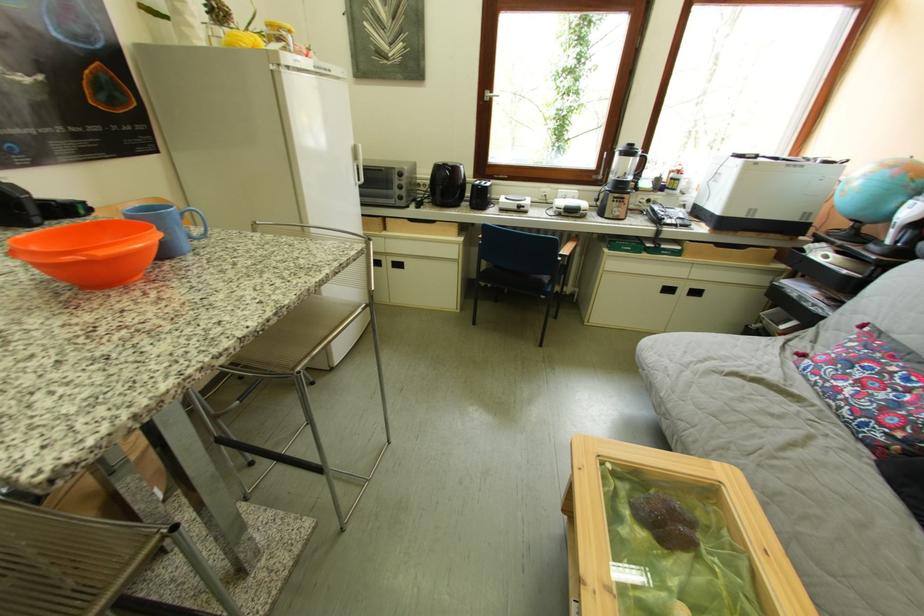
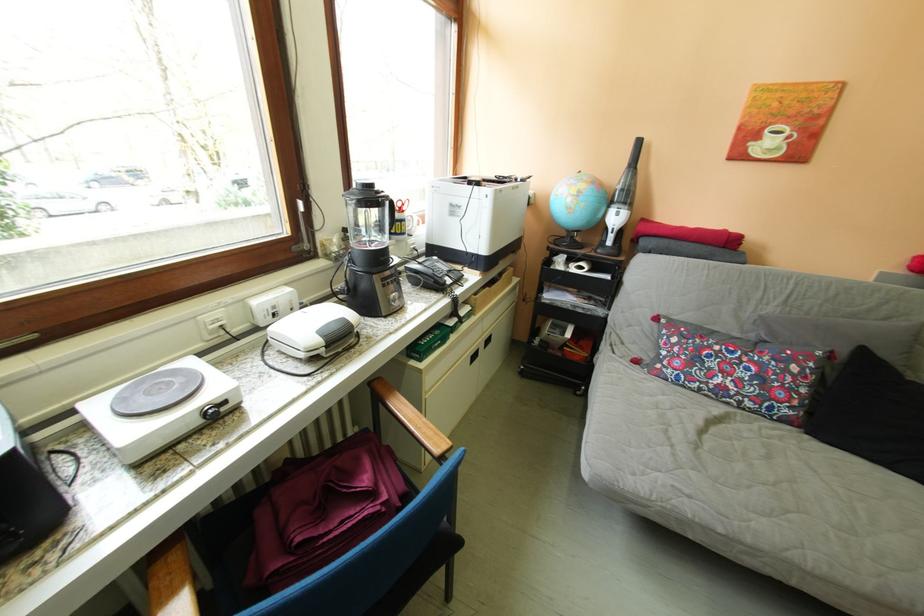
The point at (891,466) is marked in the first image. Where is the corresponding point in the second image?

(821, 437)